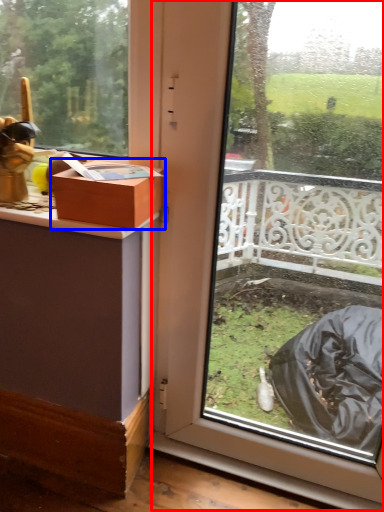
Question: Which object is closer to the camera taking this photo, glass door (highlighted by a red box) or box (highlighted by a blue box)?

Choices:
 (A) glass door
 (B) box

Answer: (A)